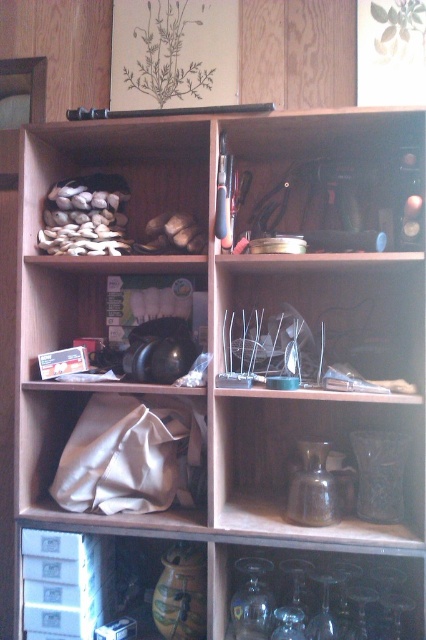
Does white fabric at lower left have a larger size compared to white matte shells at upper left?

No, white fabric at lower left is not bigger than white matte shells at upper left.

Which is in front, point (92, 396) or point (189, 163)?

Point (92, 396) is in front.

Image resolution: width=426 pixels, height=640 pixels. What do you see at coordinates (115, 451) in the screenshot? I see `white fabric at lower left` at bounding box center [115, 451].

Image resolution: width=426 pixels, height=640 pixels. Identify the location of white fabric at lower left. (115, 451).

Between matte glass vase at center and clear glass cups at center, which one has more height?

matte glass vase at center is taller.

Who is shorter, matte glass vase at center or clear glass cups at center?

With less height is clear glass cups at center.

Identify the location of matte glass vase at center. (296, 451).

Where is `matte glass vase at center`? Image resolution: width=426 pixels, height=640 pixels. matte glass vase at center is located at coordinates (296, 451).

Is matte glass vase at center closer to the viewer compared to matte black headphones at center?

Yes, it is in front of matte black headphones at center.

Who is positioned more to the right, matte glass vase at center or matte black headphones at center?

Positioned to the right is matte glass vase at center.

Is point (256, 515) farther from camera compared to point (89, 289)?

No, it is not.

Locate an element on the screen. The width and height of the screenshot is (426, 640). matte glass vase at center is located at coordinates (296, 451).